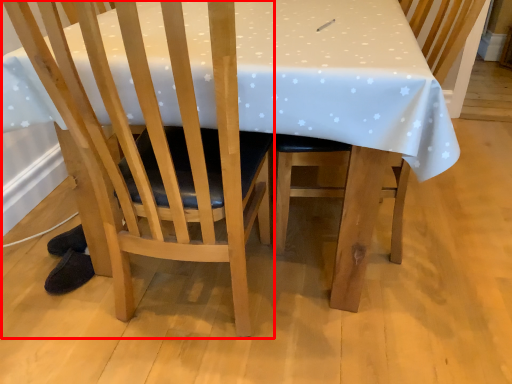
Question: Considering the relative positions of chair (annotated by the red box) and chair in the image provided, where is chair (annotated by the red box) located with respect to the staircase?

Choices:
 (A) right
 (B) left

Answer: (B)